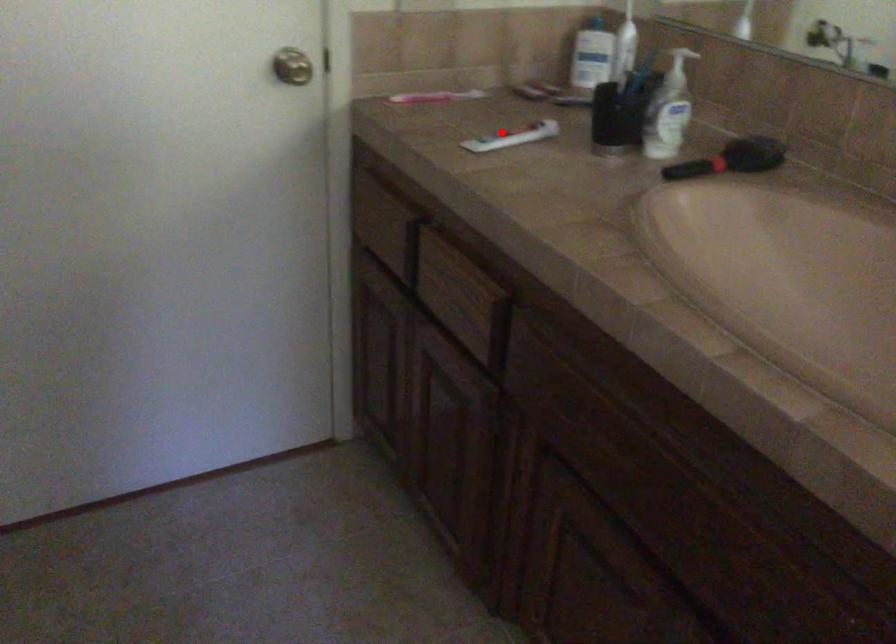
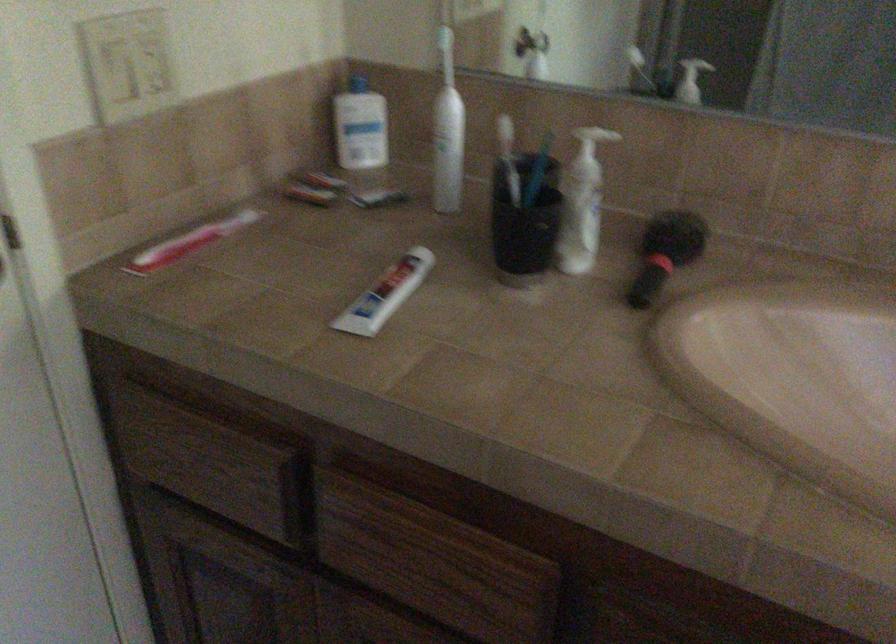
The point at the highlighted location is marked in the first image. Where is the corresponding point in the second image?

(385, 294)